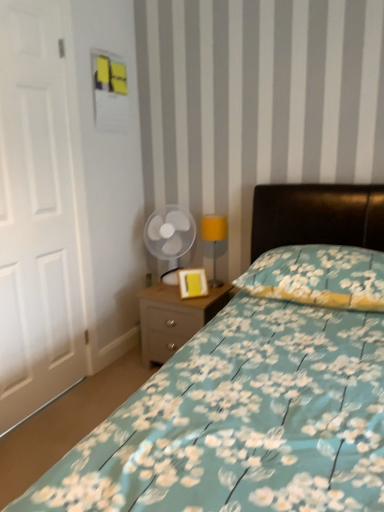
Question: From the image's perspective, is floral fabric bed at center above or below floral fabric pillow at center?

Choices:
 (A) above
 (B) below

Answer: (B)

Question: Considering the positions of floral fabric bed at center and floral fabric pillow at center in the image, is floral fabric bed at center taller or shorter than floral fabric pillow at center?

Choices:
 (A) short
 (B) tall

Answer: (B)

Question: Estimate the real-world distances between objects in this image. Which object is closer to the floral fabric bed at center?

Choices:
 (A) yellow matte picture frame at center
 (B) yellow fabric lampshade at center
 (C) white matte door at left
 (D) floral fabric pillow at center
 (E) light wood/texture nightstand at lower center

Answer: (E)

Question: Estimate the real-world distances between objects in this image. Which object is closer to the floral fabric pillow at center?

Choices:
 (A) light wood/texture nightstand at lower center
 (B) yellow fabric lampshade at center
 (C) yellow matte picture frame at center
 (D) floral fabric bed at center
 (E) transparent plastic fan at center

Answer: (A)